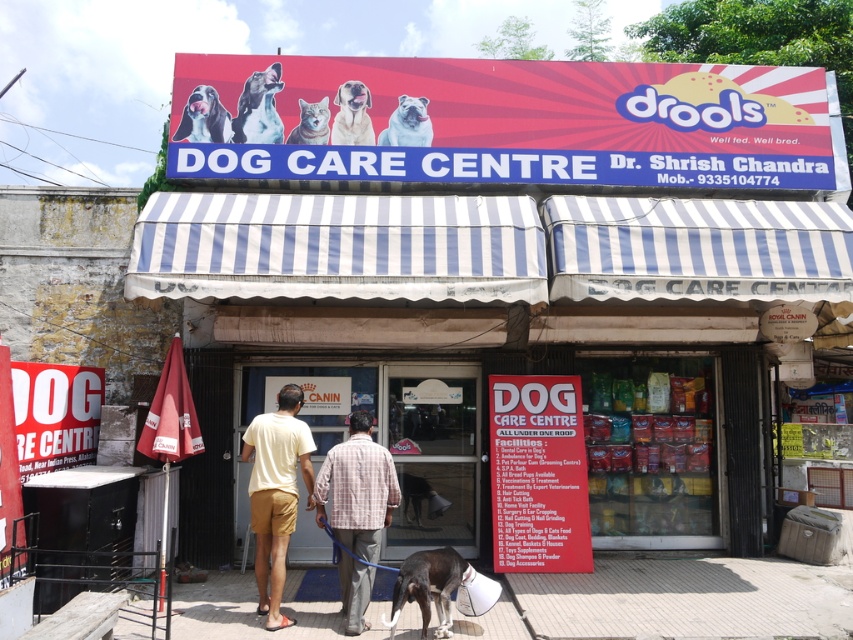
Question: Can you confirm if smooth white dog at upper left is wider than fluffy white cat at center?

Choices:
 (A) no
 (B) yes

Answer: (B)

Question: Which object is positioned closest to the light yellow t-shirt at center?

Choices:
 (A) white striped awning at center
 (B) smooth white dog at upper center
 (C) fluffy white cat at center
 (D) smooth white dog at upper left

Answer: (C)

Question: Which object is the closest to the smooth white bulldog at center?

Choices:
 (A) smooth white dog at upper center
 (B) smooth white dog at upper left
 (C) black smooth dog at lower center
 (D) smooth beige dog at center

Answer: (D)

Question: Among these points, which one is nearest to the camera?

Choices:
 (A) (412, 122)
 (B) (344, 560)
 (C) (273, 109)
 (D) (349, 100)

Answer: (B)

Question: Is the position of black smooth dog at lower center more distant than that of smooth white dog at upper center?

Choices:
 (A) no
 (B) yes

Answer: (A)

Question: Is smooth white bulldog at center thinner than fluffy white cat at center?

Choices:
 (A) yes
 (B) no

Answer: (B)